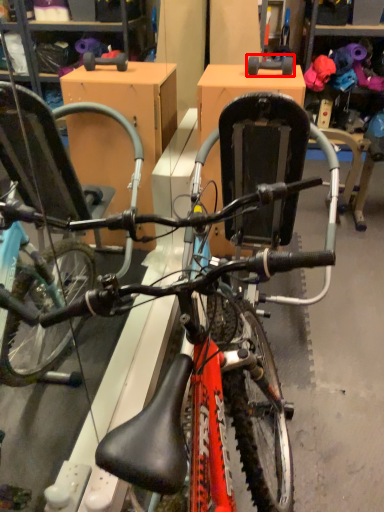
Question: From the image's perspective, what is the correct spatial relationship of wheel (annotated by the red box) in relation to bicycle?

Choices:
 (A) above
 (B) below

Answer: (A)